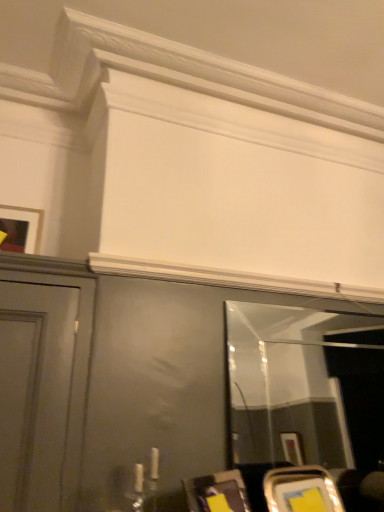
Question: Considering the positions of point click(276, 364) and point click(24, 231), is point click(276, 364) closer or farther from the camera than point click(24, 231)?

Choices:
 (A) farther
 (B) closer

Answer: (A)

Question: From a real-world perspective, relative to matte black picture frame at upper left, is clear glass mirror at center vertically above or below?

Choices:
 (A) below
 (B) above

Answer: (A)

Question: From the image's perspective, relative to matte black picture frame at upper left, is clear glass mirror at center above or below?

Choices:
 (A) below
 (B) above

Answer: (A)

Question: Considering the positions of matte black picture frame at upper left and clear glass mirror at center in the image, is matte black picture frame at upper left wider or thinner than clear glass mirror at center?

Choices:
 (A) thin
 (B) wide

Answer: (B)

Question: Is matte black picture frame at upper left taller or shorter than clear glass mirror at center?

Choices:
 (A) tall
 (B) short

Answer: (B)

Question: Is matte black picture frame at upper left spatially inside clear glass mirror at center, or outside of it?

Choices:
 (A) outside
 (B) inside

Answer: (A)

Question: Is matte black picture frame at upper left in front of or behind clear glass mirror at center in the image?

Choices:
 (A) behind
 (B) front

Answer: (A)